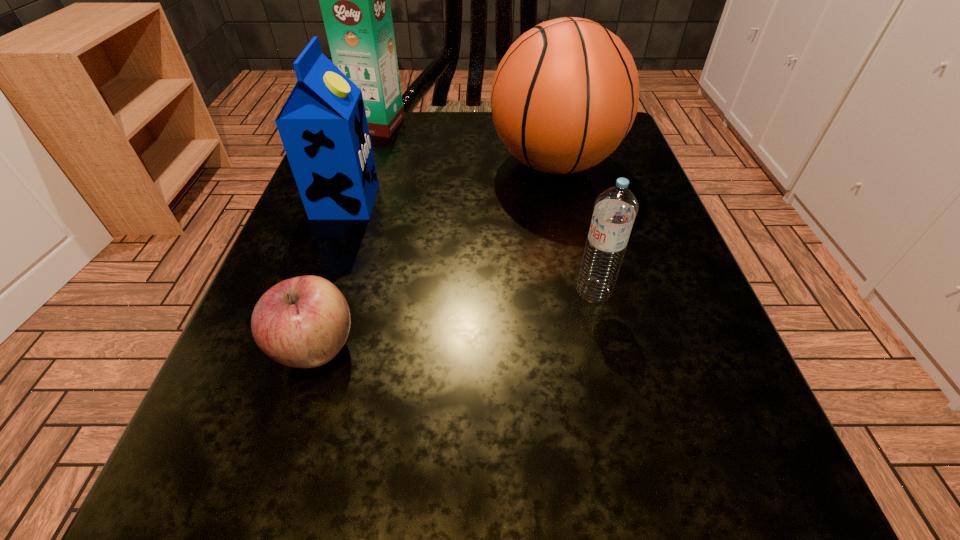
Where is `free space at the near edge of the desktop`? The width and height of the screenshot is (960, 540). free space at the near edge of the desktop is located at coordinates (417, 528).

This screenshot has width=960, height=540. In the image, there is a desktop. Find the location of `vacant area at the left edge`. vacant area at the left edge is located at coordinates (235, 387).

This screenshot has width=960, height=540. Identify the location of vacant space at the right edge. (641, 406).

Identify the location of free space at the near right corner of the desktop. This screenshot has height=540, width=960. (665, 494).

You are a GUI agent. You are given a task and a screenshot of the screen. Output one action in this format:
    pyautogui.click(x=<x>, y=<y>)
    Task: Click on the free space between the water bottle and the apple
    This screenshot has width=960, height=540.
    Given the screenshot: What is the action you would take?
    pyautogui.click(x=455, y=320)

The height and width of the screenshot is (540, 960). In order to click on blank region between the farther carton and the basketball in this screenshot , I will do `click(466, 144)`.

Where is `vacant area that lies between the nearer carton and the second shortest object`? This screenshot has height=540, width=960. vacant area that lies between the nearer carton and the second shortest object is located at coordinates (469, 246).

The width and height of the screenshot is (960, 540). Find the location of `free space that is in between the basketball and the nearer carton`. free space that is in between the basketball and the nearer carton is located at coordinates (450, 183).

Locate an element on the screen. The image size is (960, 540). free area in between the basketball and the second nearest object is located at coordinates [574, 227].

Locate an element on the screen. free space between the basketball and the fourth farthest object is located at coordinates (574, 227).